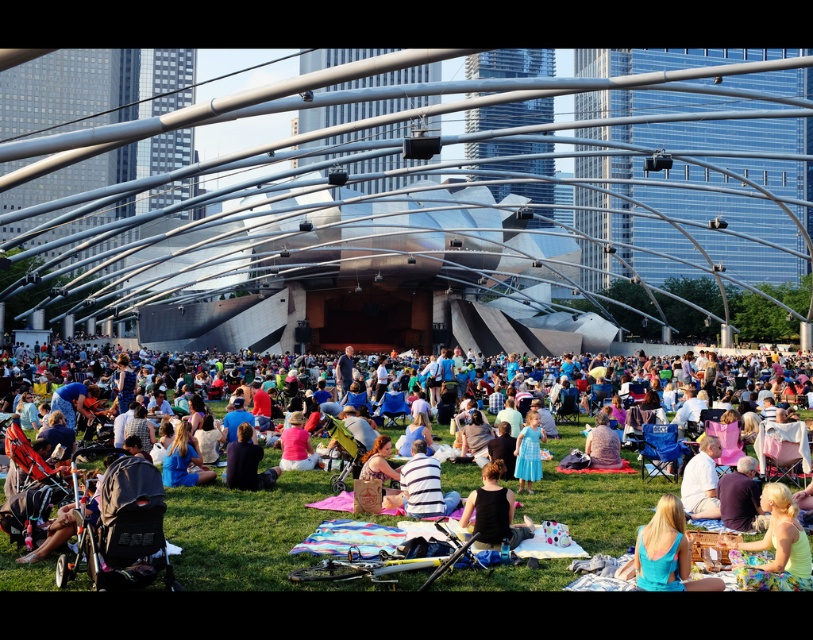
You are a photographer at the concert and need to capture a photo of both the light brown fabric shirt at center and the light blue satin dress at center in the same frame. The camera you are using has a focal length of 50mm. Considering the distance between them, is it possible to include both subjects in a single shot without moving the camera?

The distance between the light brown fabric shirt at center and the light blue satin dress at center is 12.97 meters. With a 50mm focal length, capturing both subjects in the same frame without moving the camera would be challenging due to the significant distance between them. A wider lens or repositioning might be necessary.

From the picture: In the concert scene, there is a striped fabric shirt at center. Can you tell me its exact 2D coordinates?

The striped fabric shirt at center is located at coordinates point (420, 483).

You are a photographer standing at the edge of the grassy area and want to take a photo of the blonde hair at center from where you are standing. Is the pavilion blocking your view?

The pavilion is 201.99 feet away from the blonde hair at center, so it is not blocking the view because the distance is too great for the pavilion to obstruct the line of sight.